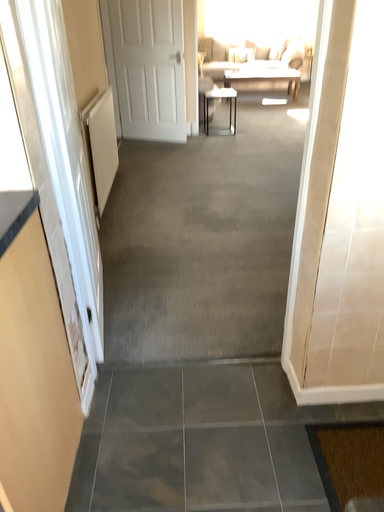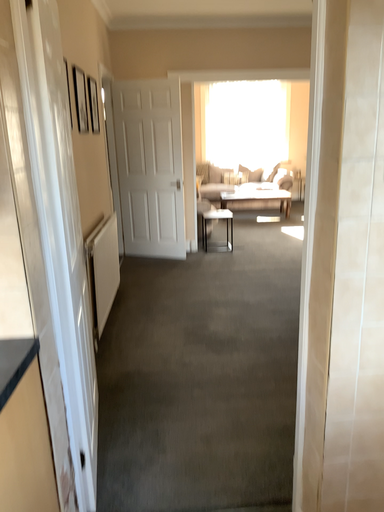
Question: How did the camera likely rotate when shooting the video?

Choices:
 (A) rotated downward
 (B) rotated upward

Answer: (B)